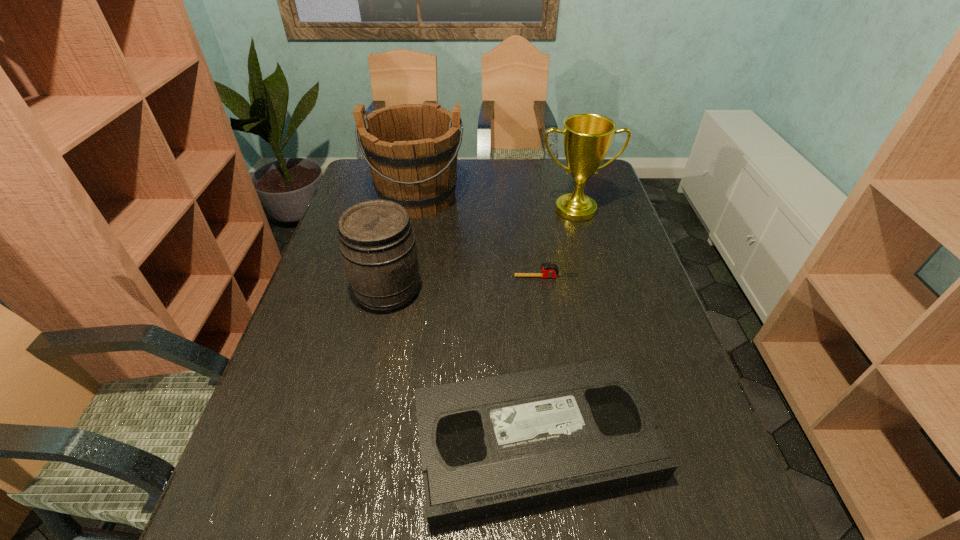
You are a GUI agent. You are given a task and a screenshot of the screen. Output one action in this format:
    pyautogui.click(x=<x>, y=<y>)
    Task: Click on the farther wine bucket
    The height and width of the screenshot is (540, 960).
    Given the screenshot: What is the action you would take?
    pyautogui.click(x=411, y=149)

This screenshot has width=960, height=540. I want to click on award, so click(587, 138).

Where is `the shorter wine bucket`? This screenshot has width=960, height=540. the shorter wine bucket is located at coordinates click(x=377, y=243).

This screenshot has height=540, width=960. Identify the location of the nearer wine bucket. (377, 243).

Locate an element on the screen. Image resolution: width=960 pixels, height=540 pixels. videotape is located at coordinates (491, 446).

Identify the location of the second shortest object. (491, 446).

The width and height of the screenshot is (960, 540). Identify the location of tape measure. (549, 270).

Where is `blank space located on the side of the farther wine bucket with the handle for carrying`? The image size is (960, 540). blank space located on the side of the farther wine bucket with the handle for carrying is located at coordinates (411, 234).

Identify the location of vacant space located by the handles of the award. (600, 299).

The width and height of the screenshot is (960, 540). Identify the location of vacant space located on the back of the shorter wine bucket. (398, 240).